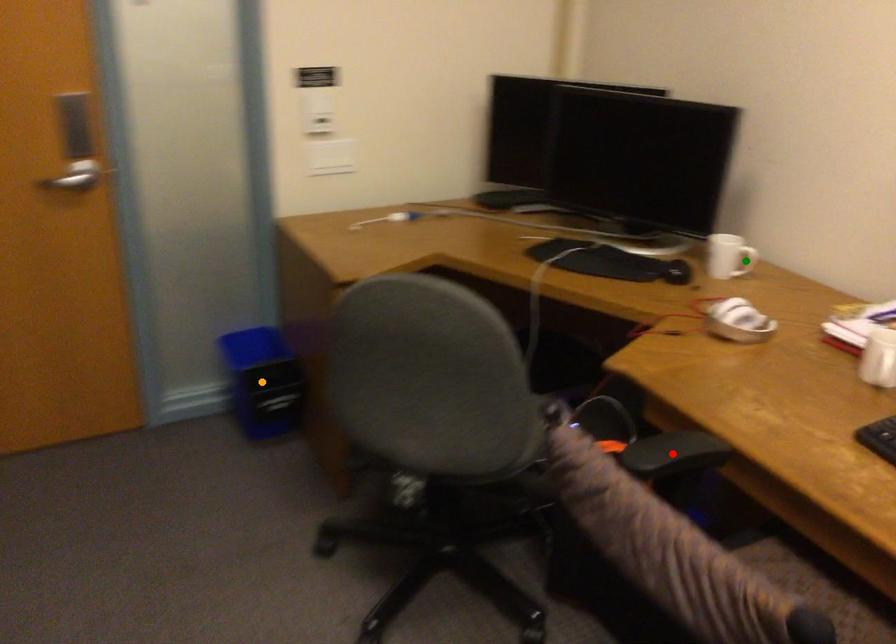
Order these from nearest to farthest:
A) red point
B) orange point
C) green point

red point → green point → orange point